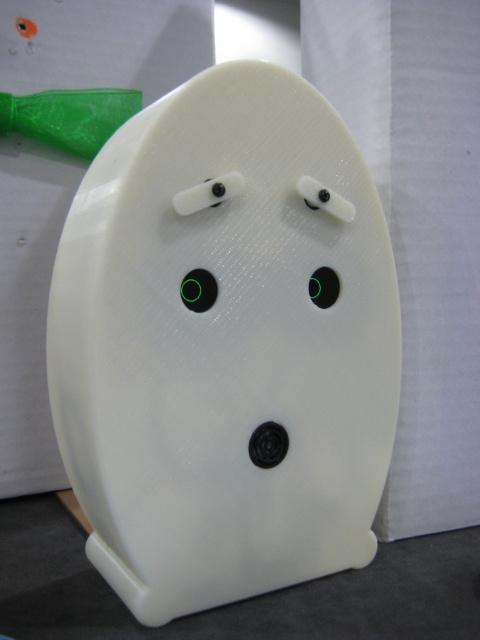
Question: Estimate the real-world distances between objects in this image. Which object is closer to the white matte urinal at center?

Choices:
 (A) black matte circle at center
 (B) matte black circle at center

Answer: (B)

Question: Which of these objects is positioned closest to the white matte urinal at center?

Choices:
 (A) matte black circle at center
 (B) black matte circle at center

Answer: (A)

Question: Can you confirm if white matte urinal at center is positioned below matte black circle at center?

Choices:
 (A) no
 (B) yes

Answer: (B)

Question: Does white matte urinal at center have a smaller size compared to black matte circle at center?

Choices:
 (A) yes
 (B) no

Answer: (B)

Question: Which object is farther from the camera taking this photo?

Choices:
 (A) white matte urinal at center
 (B) black matte circle at center
 (C) matte black circle at center

Answer: (B)

Question: Can you confirm if white matte urinal at center is positioned to the left of black matte circle at center?

Choices:
 (A) yes
 (B) no

Answer: (A)